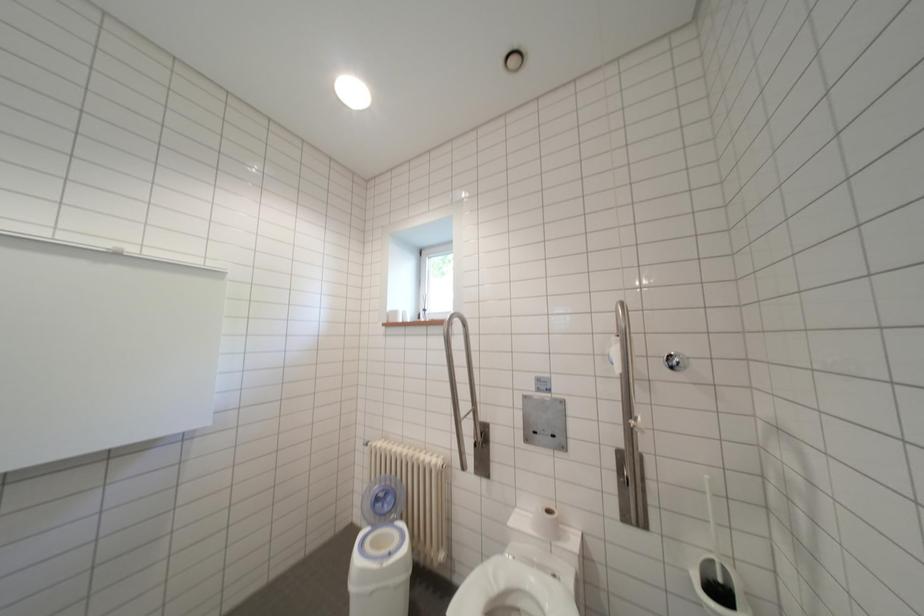
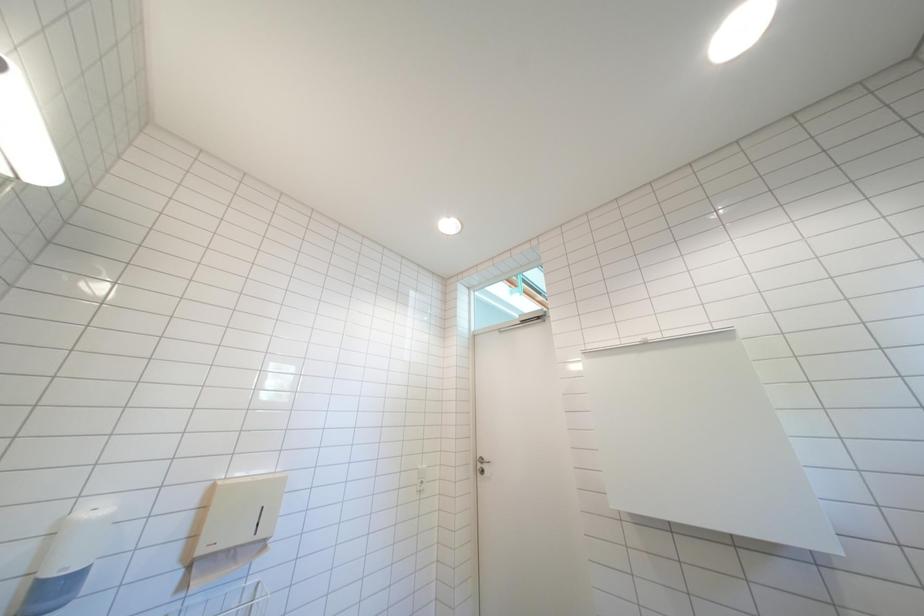
First-person continuous shooting, in which direction is the camera rotating?

The rotation direction of the camera is left-up.